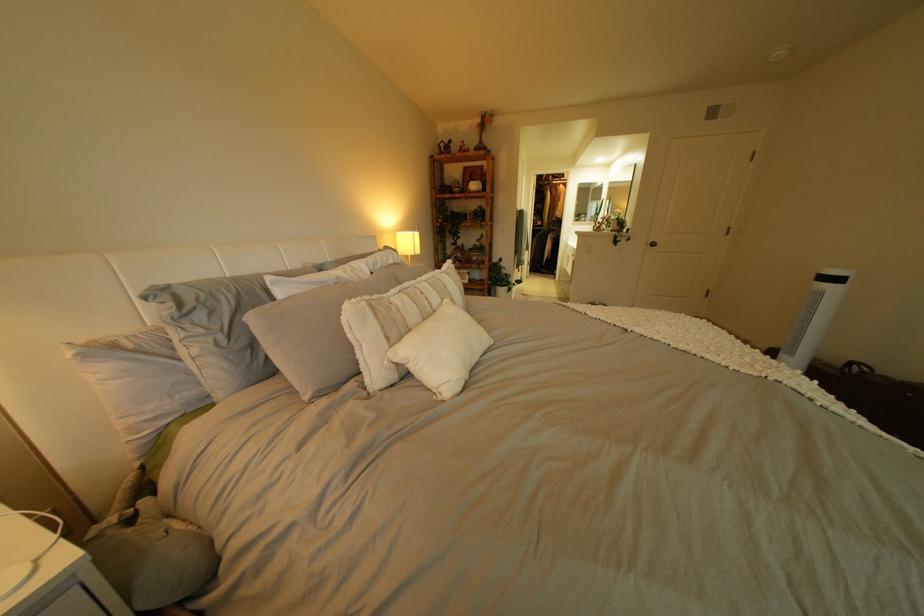
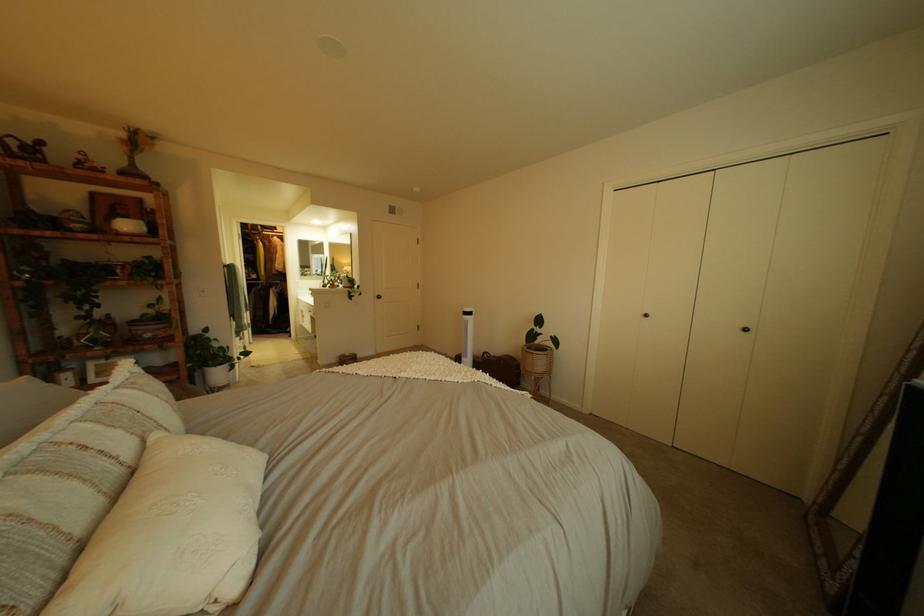
Where in the second image is the point corresponding to pixel 565 177 from the first image?

(274, 228)